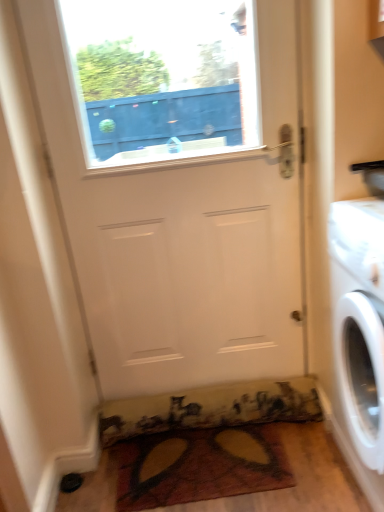
Identify the location of empty space that is ontop of multicolored fabric doormat at lower center, which appears as the first doormat when ordered from the bottom (from a real-world perspective). tap(203, 455).